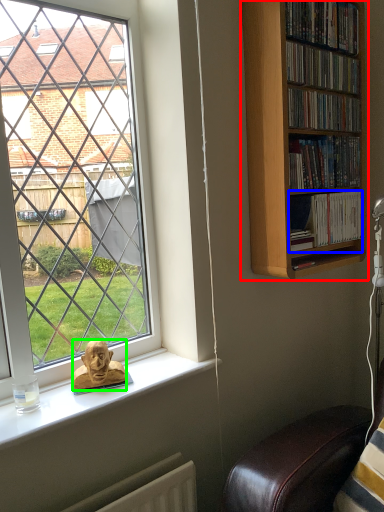
Question: Which is nearer to the bookcase (highlighted by a red box)? book (highlighted by a blue box) or person (highlighted by a green box).

Choices:
 (A) book
 (B) person

Answer: (A)